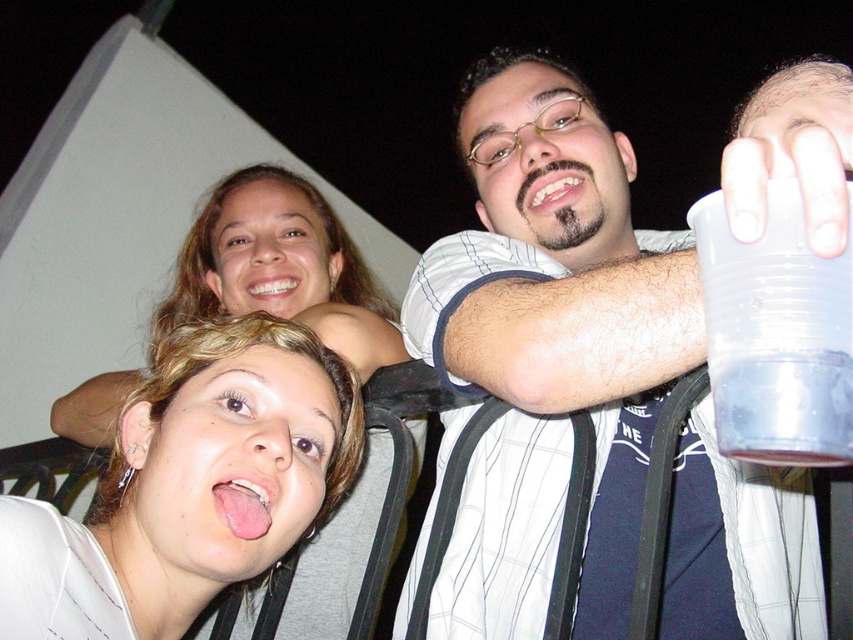
You are taking a photo of three people at night on a balcony. The subjects include a woman in a white top with her tongue out, another woman in a gray top smiling, and a third person wearing a white striped shirt at upper center. Based on their positions, can you determine which subject is positioned closest to the camera?

The white striped shirt at upper center is located at point (x=548, y=346), so the subject wearing the white striped shirt at upper center is closest to the camera.

You are standing on a balcony at night and see the three people in the image. The point at coordinates [548,346] is marked. What object is located at that point?

The point at coordinates [548,346] marks the white striped shirt at upper center.